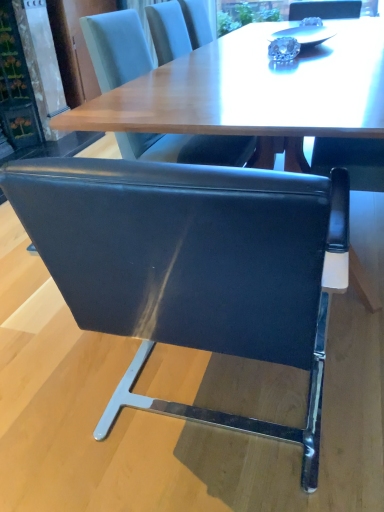
Where is `black leather chair at upper center, arranged as the second chair when viewed from the left`? The image size is (384, 512). black leather chair at upper center, arranged as the second chair when viewed from the left is located at coordinates (116, 47).

Describe the element at coordinates (116, 47) in the screenshot. I see `black leather chair at upper center, arranged as the second chair when viewed from the left` at that location.

What do you see at coordinates (192, 267) in the screenshot?
I see `black leather chair at center, the 2th chair in the right-to-left sequence` at bounding box center [192, 267].

Measure the distance between point (318, 397) and camera.

Point (318, 397) is 3.92 feet from camera.

At what (x,y) coordinates should I click in order to perform the action: click on black leather chair at center, which is the 1th chair from left to right. Please return your answer as a coordinate pair (x, y). Image resolution: width=384 pixels, height=512 pixels. Looking at the image, I should click on (192, 267).

Locate an element on the screen. black leather chair at upper center, which ranks as the first chair in right-to-left order is located at coordinates (116, 47).

Considering the relative positions of black leather chair at center, which is the 1th chair from left to right, and black leather chair at upper center, arranged as the second chair when viewed from the left, in the image provided, is black leather chair at center, which is the 1th chair from left to right, to the left or to the right of black leather chair at upper center, arranged as the second chair when viewed from the left,?

From the image, it's evident that black leather chair at center, which is the 1th chair from left to right, is to the left of black leather chair at upper center, arranged as the second chair when viewed from the left.

Which object is closer to the camera taking this photo, black leather chair at center, which is the 1th chair from left to right, or black leather chair at upper center, which ranks as the first chair in right-to-left order?

black leather chair at center, which is the 1th chair from left to right, is closer to the camera.

Which is behind, point (280, 254) or point (124, 71)?

Point (124, 71)

From the image's perspective, between black leather chair at center, which is the 1th chair from left to right, and black leather chair at upper center, which ranks as the first chair in right-to-left order, who is located below?

From the image's view, black leather chair at center, which is the 1th chair from left to right, is below.

From a real-world perspective, is black leather chair at center, the 2th chair in the right-to-left sequence, physically above black leather chair at upper center, which ranks as the first chair in right-to-left order?

Incorrect, from a real-world perspective, black leather chair at center, the 2th chair in the right-to-left sequence, is lower than black leather chair at upper center, which ranks as the first chair in right-to-left order.

Which of these two, black leather chair at center, the 2th chair in the right-to-left sequence, or black leather chair at upper center, arranged as the second chair when viewed from the left, is wider?

black leather chair at center, the 2th chair in the right-to-left sequence.

Who is shorter, black leather chair at center, which is the 1th chair from left to right, or black leather chair at upper center, which ranks as the first chair in right-to-left order?

black leather chair at center, which is the 1th chair from left to right.

In the scene shown: Between black leather chair at center, which is the 1th chair from left to right, and black leather chair at upper center, arranged as the second chair when viewed from the left, which one has larger size?

black leather chair at center, which is the 1th chair from left to right, is bigger.

Can we say black leather chair at center, the 2th chair in the right-to-left sequence, lies outside black leather chair at upper center, which ranks as the first chair in right-to-left order?

Yes, black leather chair at center, the 2th chair in the right-to-left sequence, is located beyond the bounds of black leather chair at upper center, which ranks as the first chair in right-to-left order.

Is black leather chair at center, which is the 1th chair from left to right, next to black leather chair at upper center, which ranks as the first chair in right-to-left order?

black leather chair at center, which is the 1th chair from left to right, and black leather chair at upper center, which ranks as the first chair in right-to-left order, are not in contact.

Is black leather chair at center, which is the 1th chair from left to right, oriented towards black leather chair at upper center, which ranks as the first chair in right-to-left order?

No.

How many degrees apart are the facing directions of black leather chair at center, which is the 1th chair from left to right, and black leather chair at upper center, arranged as the second chair when viewed from the left?

There is a 91.7-degree angle between the facing directions of black leather chair at center, which is the 1th chair from left to right, and black leather chair at upper center, arranged as the second chair when viewed from the left.

Where is `chair below the black leather chair at upper center, which ranks as the first chair in right-to-left order (from a real-world perspective)`? The image size is (384, 512). chair below the black leather chair at upper center, which ranks as the first chair in right-to-left order (from a real-world perspective) is located at coordinates (192, 267).

Which object is positioned more to the left, black leather chair at upper center, arranged as the second chair when viewed from the left, or black leather chair at center, the 2th chair in the right-to-left sequence?

From the viewer's perspective, black leather chair at center, the 2th chair in the right-to-left sequence, appears more on the left side.

Which object is further away from the camera taking this photo, black leather chair at upper center, which ranks as the first chair in right-to-left order, or black leather chair at center, the 2th chair in the right-to-left sequence?

Positioned behind is black leather chair at upper center, which ranks as the first chair in right-to-left order.

Does point (122, 82) appear closer or farther from the camera than point (258, 293)?

Point (122, 82).

From the image's perspective, relative to black leather chair at center, which is the 1th chair from left to right, is black leather chair at upper center, which ranks as the first chair in right-to-left order, above or below?

Clearly, from the image's perspective, black leather chair at upper center, which ranks as the first chair in right-to-left order, is above black leather chair at center, which is the 1th chair from left to right.

From a real-world perspective, is black leather chair at upper center, which ranks as the first chair in right-to-left order, positioned over black leather chair at center, which is the 1th chair from left to right, based on gravity?

Yes.

Which of these two, black leather chair at upper center, arranged as the second chair when viewed from the left, or black leather chair at center, which is the 1th chair from left to right, is wider?

Wider between the two is black leather chair at center, which is the 1th chair from left to right.

From their relative heights in the image, would you say black leather chair at upper center, arranged as the second chair when viewed from the left, is taller or shorter than black leather chair at center, the 2th chair in the right-to-left sequence?

Considering their sizes, black leather chair at upper center, arranged as the second chair when viewed from the left, has more height than black leather chair at center, the 2th chair in the right-to-left sequence.

In the scene shown: Between black leather chair at upper center, arranged as the second chair when viewed from the left, and black leather chair at center, which is the 1th chair from left to right, which one has larger size?

black leather chair at center, which is the 1th chair from left to right.

Can black leather chair at center, the 2th chair in the right-to-left sequence, be found inside black leather chair at upper center, which ranks as the first chair in right-to-left order?

No, black leather chair at center, the 2th chair in the right-to-left sequence, is not a part of black leather chair at upper center, which ranks as the first chair in right-to-left order.

Is black leather chair at upper center, arranged as the second chair when viewed from the left, beside black leather chair at center, which is the 1th chair from left to right?

No, black leather chair at upper center, arranged as the second chair when viewed from the left, is not with black leather chair at center, which is the 1th chair from left to right.

Is black leather chair at upper center, which ranks as the first chair in right-to-left order, oriented towards black leather chair at center, the 2th chair in the right-to-left sequence?

No, black leather chair at upper center, which ranks as the first chair in right-to-left order, is not turned towards black leather chair at center, the 2th chair in the right-to-left sequence.

How many degrees apart are the facing directions of black leather chair at upper center, which ranks as the first chair in right-to-left order, and black leather chair at center, the 2th chair in the right-to-left sequence?

91.7 degrees.

Locate an element on the screen. chair behind the black leather chair at center, which is the 1th chair from left to right is located at coordinates (116, 47).

This screenshot has width=384, height=512. I want to click on chair in front of the black leather chair at upper center, which ranks as the first chair in right-to-left order, so click(x=192, y=267).

Identify the location of chair on the right of black leather chair at center, the 2th chair in the right-to-left sequence. (116, 47).